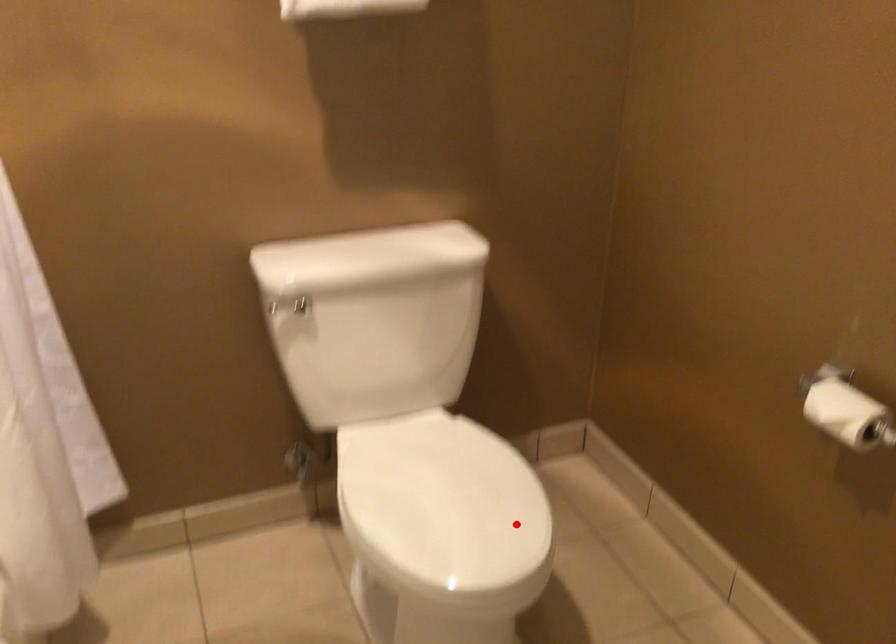
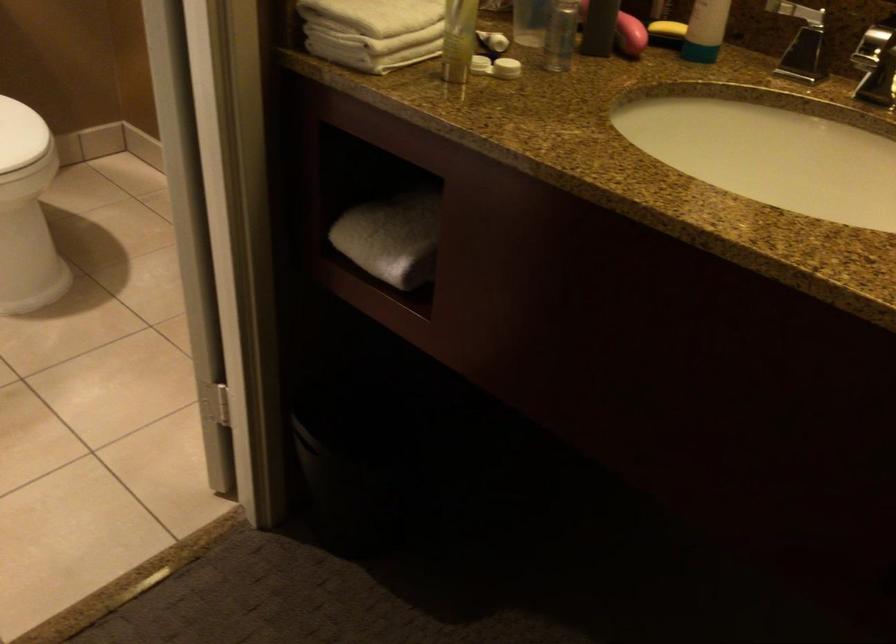
Question: I am providing you with two images of the same scene from different viewpoints. In image1, a red point is highlighted. Considering the same 3D point in image2, which of the following is correct?

Choices:
 (A) It is closer
 (B) It is farther

Answer: (B)